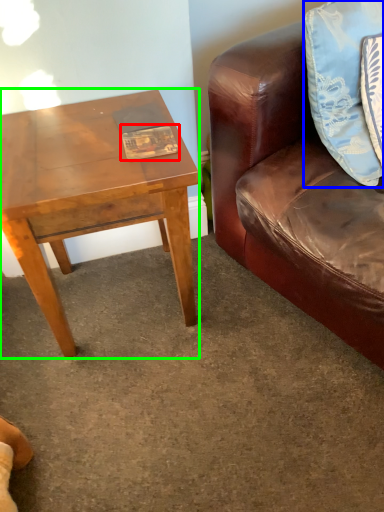
Question: Considering the real-world distances, which object is closest to book (highlighted by a red box)? pillow (highlighted by a blue box) or coffee table (highlighted by a green box).

Choices:
 (A) pillow
 (B) coffee table

Answer: (B)